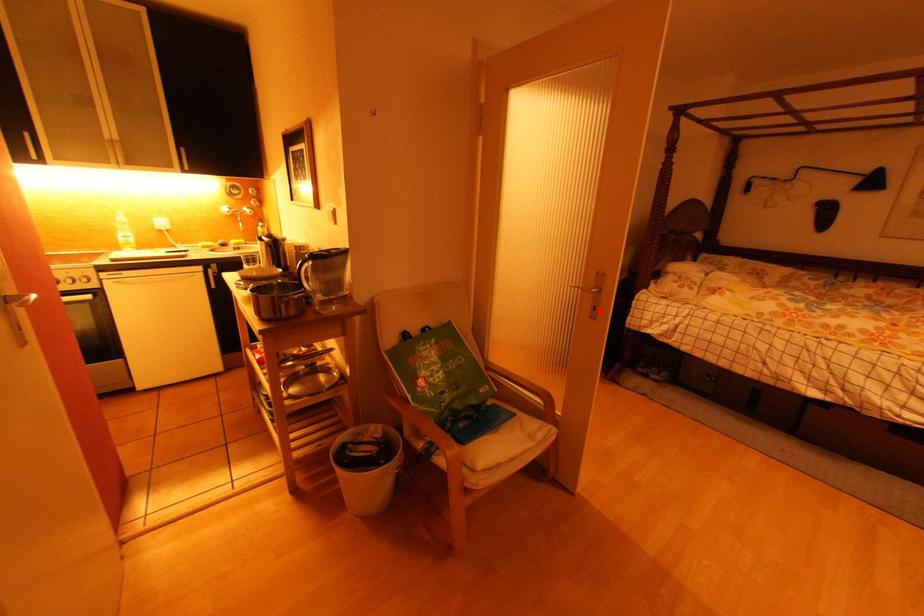
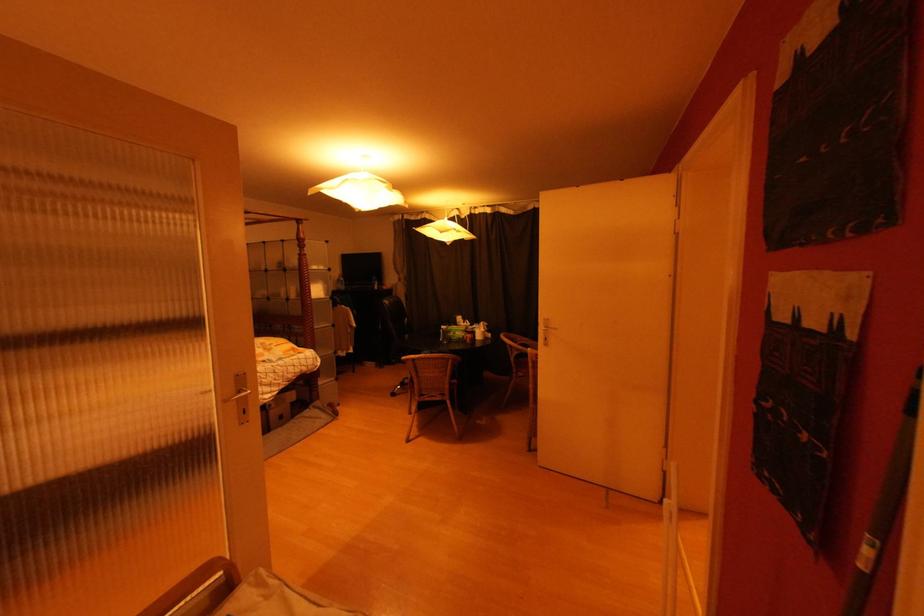
Question: I am providing you with two images of the same scene from different viewpoints. Given a red point in image1, look at the same physical point in image2. Is it:

Choices:
 (A) Closer to the viewpoint
 (B) Farther from the viewpoint

Answer: (A)